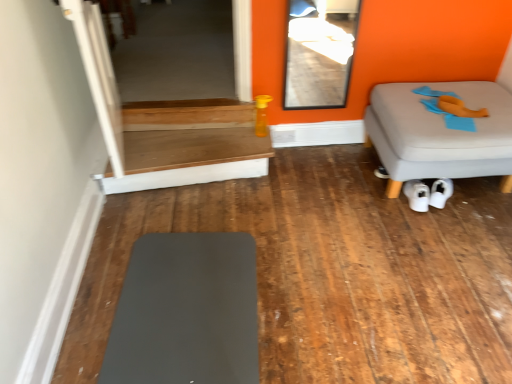
Image resolution: width=512 pixels, height=384 pixels. What are the coordinates of `free location above matte gray mat at lower left, the first furniture from the front (from a real-world perspective)` in the screenshot? It's located at (184, 301).